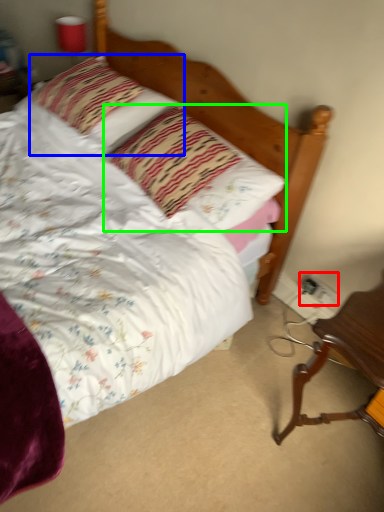
Question: Which object is the closest to the electric outlet (highlighted by a red box)? Choose among these: pillow (highlighted by a blue box) or pillow (highlighted by a green box).

Choices:
 (A) pillow
 (B) pillow

Answer: (B)